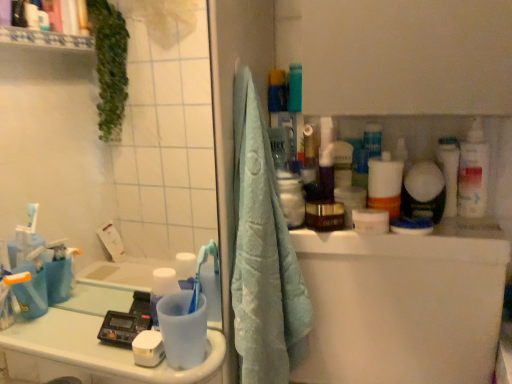
Question: Is the depth of white plastic bottle at right less than that of light blue towel at center?

Choices:
 (A) yes
 (B) no

Answer: (B)

Question: Is white plastic bottle at right wider than light blue towel at center?

Choices:
 (A) yes
 (B) no

Answer: (B)

Question: Is white plastic bottle at right at the right side of light blue towel at center?

Choices:
 (A) no
 (B) yes

Answer: (B)

Question: From the image's perspective, would you say white plastic bottle at right is positioned over light blue towel at center?

Choices:
 (A) no
 (B) yes

Answer: (B)

Question: Can you confirm if white plastic bottle at right is bigger than light blue towel at center?

Choices:
 (A) no
 (B) yes

Answer: (A)

Question: Based on their positions, is light blue towel at center located to the left or right of white glossy toothbrush at upper right?

Choices:
 (A) right
 (B) left

Answer: (B)

Question: Is light blue towel at center bigger or smaller than white glossy toothbrush at upper right?

Choices:
 (A) small
 (B) big

Answer: (B)

Question: From a real-world perspective, is light blue towel at center positioned above or below white glossy toothbrush at upper right?

Choices:
 (A) below
 (B) above

Answer: (A)

Question: Choose the correct answer: Is light blue towel at center inside white glossy toothbrush at upper right or outside it?

Choices:
 (A) inside
 (B) outside

Answer: (B)

Question: Is white glossy counter top at lower left in front of or behind blue plastic toothbrush at lower left in the image?

Choices:
 (A) front
 (B) behind

Answer: (A)

Question: Does point (110, 357) appear closer or farther from the camera than point (202, 253)?

Choices:
 (A) closer
 (B) farther

Answer: (A)

Question: From the image's perspective, is white glossy counter top at lower left above or below blue plastic toothbrush at lower left?

Choices:
 (A) below
 (B) above

Answer: (A)

Question: Which is correct: white glossy counter top at lower left is inside blue plastic toothbrush at lower left, or outside of it?

Choices:
 (A) outside
 (B) inside

Answer: (A)

Question: Looking at their shapes, would you say white glossy toothbrush at upper right is wider or thinner than white glossy counter top at lower left?

Choices:
 (A) thin
 (B) wide

Answer: (A)

Question: From the image's perspective, is white glossy toothbrush at upper right located above or below white glossy counter top at lower left?

Choices:
 (A) below
 (B) above

Answer: (B)